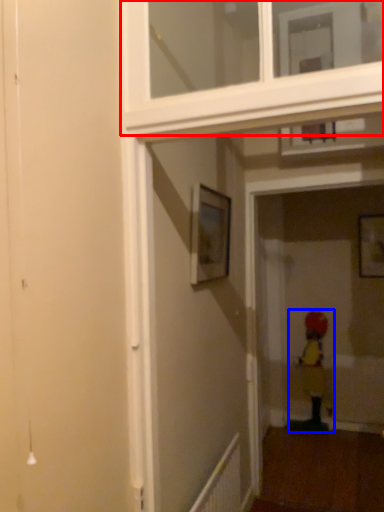
Question: Which of the following is the closest to the observer, window frame (highlighted by a red box) or child (highlighted by a blue box)?

Choices:
 (A) window frame
 (B) child

Answer: (A)